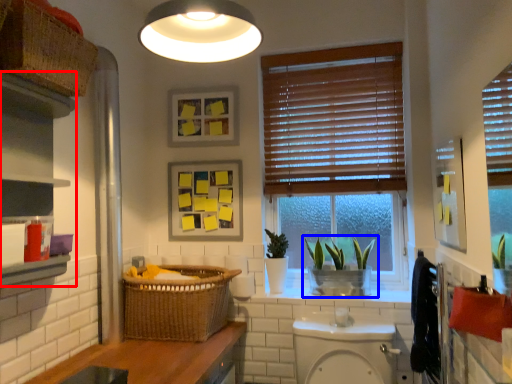
Question: Which object is further to the camera taking this photo, cabinetry (highlighted by a red box) or houseplant (highlighted by a blue box)?

Choices:
 (A) cabinetry
 (B) houseplant

Answer: (B)